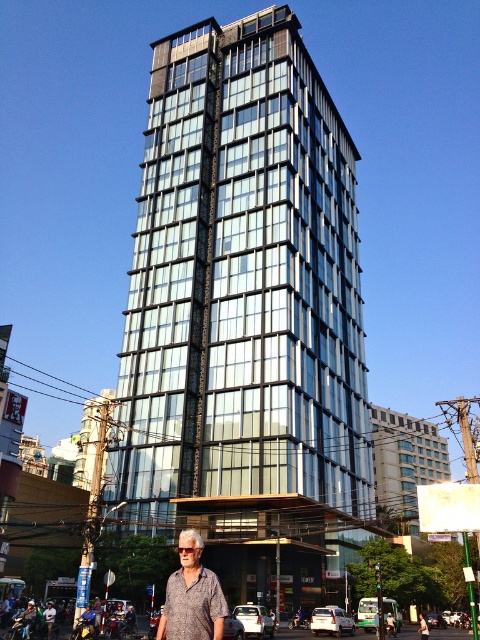
Between point (237, 248) and point (169, 602), which one is positioned in front?

Positioned in front is point (169, 602).

Is glassy steel building at center wider than printed cotton shirt at center?

Indeed, glassy steel building at center has a greater width compared to printed cotton shirt at center.

Describe the element at coordinates (245, 316) in the screenshot. I see `glassy steel building at center` at that location.

This screenshot has height=640, width=480. Identify the location of glassy steel building at center. (245, 316).